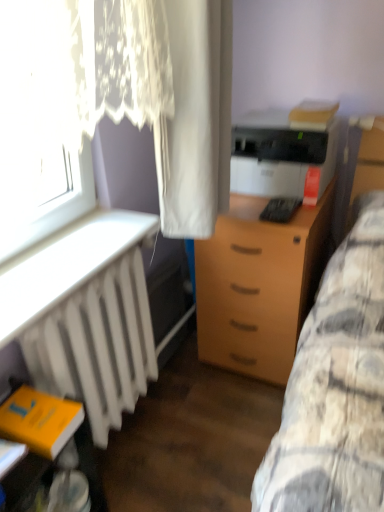
The width and height of the screenshot is (384, 512). Find the location of `vacant region above white plastic radiator at left (from a real-world perspective)`. vacant region above white plastic radiator at left (from a real-world perspective) is located at coordinates (62, 254).